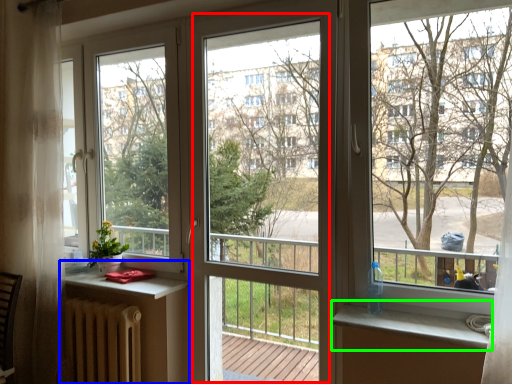
Question: Which is nearer to the screen door (highlighted by a red box)? table (highlighted by a blue box) or window sill (highlighted by a green box).

Choices:
 (A) table
 (B) window sill

Answer: (A)